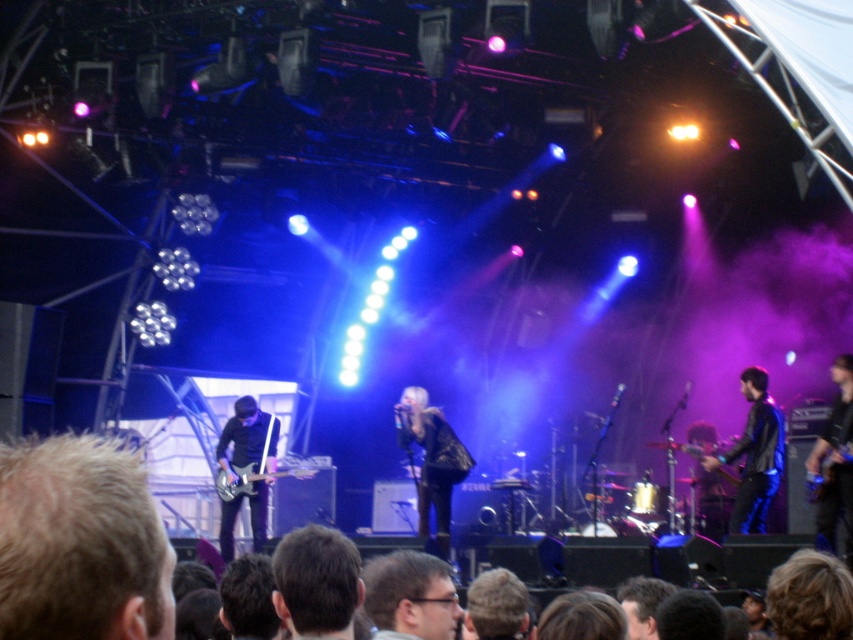
Question: Can you confirm if matte black glasses at lower center is bigger than metallic electric guitar at left?

Choices:
 (A) yes
 (B) no

Answer: (B)

Question: Is shiny black jacket at center wider than metallic electric guitar at left?

Choices:
 (A) no
 (B) yes

Answer: (B)

Question: Estimate the real-world distances between objects in this image. Which object is farther from the matte black glasses at lower center?

Choices:
 (A) shiny black jacket at center
 (B) blonde hair at lower left
 (C) black leather jacket at right

Answer: (A)

Question: Estimate the real-world distances between objects in this image. Which object is closer to the black leather jacket at right?

Choices:
 (A) blonde hair at lower left
 (B) shiny black jacket at center
 (C) matte black glasses at lower center
 (D) metallic electric guitar at left

Answer: (B)

Question: Does black leather jacket at right have a lesser width compared to metallic electric guitar at left?

Choices:
 (A) yes
 (B) no

Answer: (A)

Question: Estimate the real-world distances between objects in this image. Which object is farther from the metallic electric guitar at left?

Choices:
 (A) black leather jacket at right
 (B) blonde hair at lower left
 (C) shiny black jacket at center

Answer: (B)